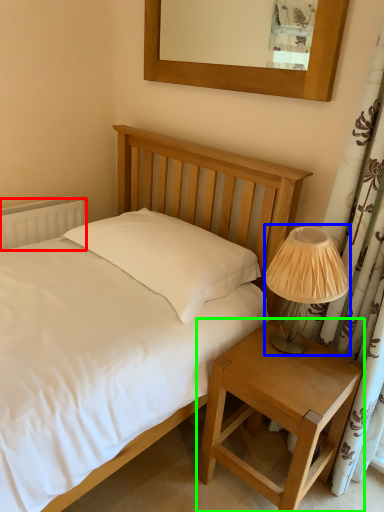
Question: Estimate the real-world distances between objects in this image. Which object is farther from radiator (highlighted by a red box), table lamp (highlighted by a blue box) or nightstand (highlighted by a green box)?

Choices:
 (A) table lamp
 (B) nightstand

Answer: (B)